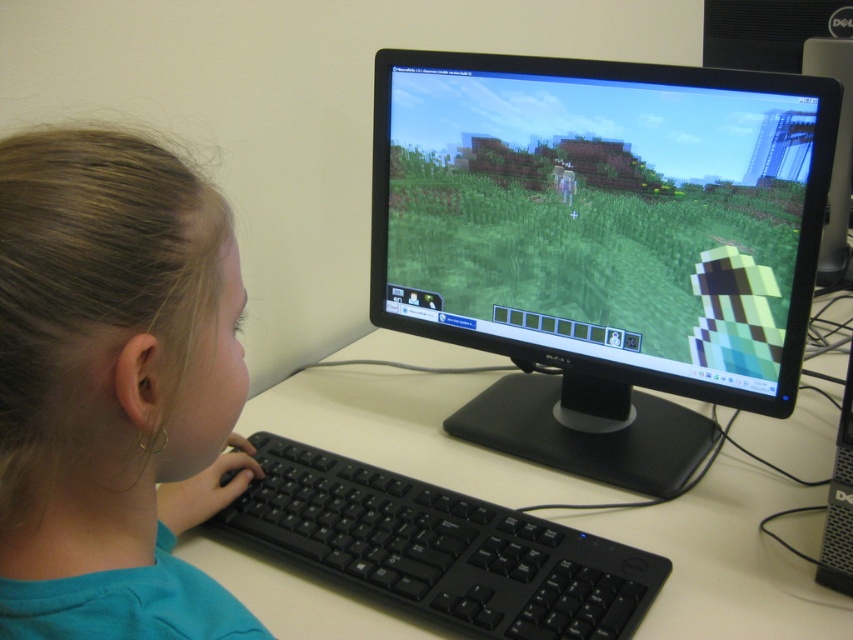
Question: Can you confirm if black matte monitor at center is bigger than white plastic computer desk at center?

Choices:
 (A) no
 (B) yes

Answer: (A)

Question: Among these objects, which one is farthest from the camera?

Choices:
 (A) black plastic keyboard at center
 (B) smooth skin face at center

Answer: (A)

Question: Which is nearer to the black plastic tower at right?

Choices:
 (A) smooth skin face at center
 (B) black plastic keyboard at center

Answer: (B)

Question: Which object is the farthest from the black plastic keyboard at center?

Choices:
 (A) white plastic computer desk at center
 (B) smooth skin face at center
 (C) black matte monitor at center
 (D) black plastic tower at right

Answer: (D)

Question: Does black matte monitor at center have a larger size compared to smooth skin face at center?

Choices:
 (A) yes
 (B) no

Answer: (A)

Question: In this image, where is black matte monitor at center located relative to black plastic tower at right?

Choices:
 (A) left
 (B) right

Answer: (A)